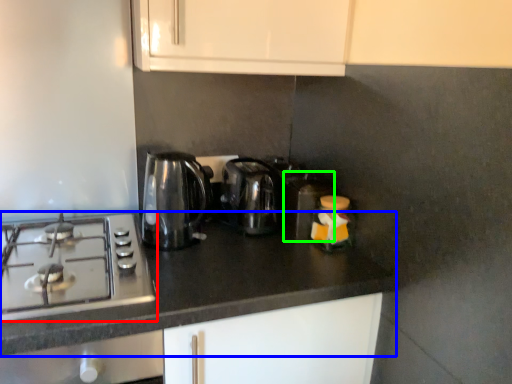
Question: Which object is positioned closest to gas stove (highlighted by a red box)? Select from countertop (highlighted by a blue box) and appliance (highlighted by a green box).

Choices:
 (A) countertop
 (B) appliance

Answer: (A)